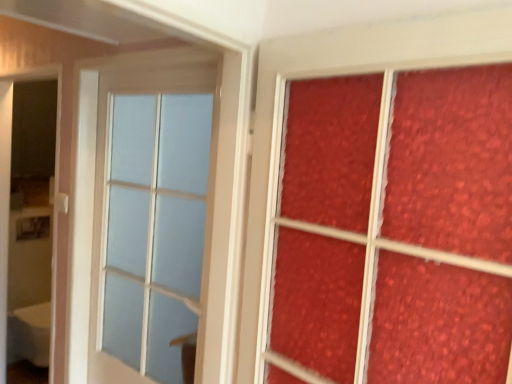
Measure the distance between matte glass window at center and camera.

The distance of matte glass window at center from camera is 4.80 feet.

I want to click on matte glass window at center, so click(154, 228).

The image size is (512, 384). What do you see at coordinates (62, 202) in the screenshot?
I see `white plastic door handle at upper left` at bounding box center [62, 202].

This screenshot has height=384, width=512. What do you see at coordinates (395, 230) in the screenshot?
I see `matte textured glass at right` at bounding box center [395, 230].

This screenshot has height=384, width=512. Find the location of `matte glass window at center`. matte glass window at center is located at coordinates (154, 228).

Considering the positions of objects matte glass window at center and white glossy screen door at left in the image provided, who is behind, matte glass window at center or white glossy screen door at left?

white glossy screen door at left is further away from the camera.

From a real-world perspective, is matte glass window at center located higher than white glossy screen door at left?

Yes, from a real-world perspective, matte glass window at center is over white glossy screen door at left

Looking at this image, is matte glass window at center not near white glossy screen door at left?

Actually, matte glass window at center and white glossy screen door at left are a little close together.

Considering the relative sizes of matte glass window at center and white glossy screen door at left in the image provided, is matte glass window at center thinner than white glossy screen door at left?

Yes, matte glass window at center is thinner than white glossy screen door at left.

Considering the sizes of matte textured glass at right and white glossy screen door at left in the image, is matte textured glass at right bigger or smaller than white glossy screen door at left?

Clearly, matte textured glass at right is smaller in size than white glossy screen door at left.

Is matte textured glass at right turned away from white glossy screen door at left?

No, matte textured glass at right is not facing away from white glossy screen door at left.

Are matte textured glass at right and white glossy screen door at left far apart?

Yes, matte textured glass at right and white glossy screen door at left are quite far apart.

Is matte textured glass at right surrounding white glossy screen door at left?

No, white glossy screen door at left is not surrounded by matte textured glass at right.

Is white plastic door handle at upper left thinner than white glossy screen door at left?

Yes, white plastic door handle at upper left is thinner than white glossy screen door at left.

Consider the image. Is white plastic door handle at upper left inside or outside of white glossy screen door at left?

white plastic door handle at upper left lies within the bounds of white glossy screen door at left.

Considering the positions of points (57, 203) and (0, 333), is point (57, 203) closer to camera compared to point (0, 333)?

That is True.

Is white plastic door handle at upper left touching white glossy screen door at left?

No, white plastic door handle at upper left is not making contact with white glossy screen door at left.

Based on the photo, which is more to the right, white glossy screen door at left or matte glass window at center?

From the viewer's perspective, matte glass window at center appears more on the right side.

Does point (5, 182) come farther from viewer compared to point (116, 129)?

Yes.

Is white glossy screen door at left outside of matte glass window at center?

white glossy screen door at left is positioned outside matte glass window at center.

From a real-world perspective, who is located lower, matte textured glass at right or matte glass window at center?

matte glass window at center is physically lower.

Is matte textured glass at right in front of or behind matte glass window at center in the image?

In the image, matte textured glass at right appears in front of matte glass window at center.

Looking at this image, is matte textured glass at right to the right of matte glass window at center from the viewer's perspective?

Yes, matte textured glass at right is to the right of matte glass window at center.

Which is in front, point (275, 313) or point (113, 296)?

The point (275, 313) is more forward.

From the image's perspective, is matte textured glass at right above white plastic door handle at upper left?

Incorrect, from the image's perspective, matte textured glass at right is lower than white plastic door handle at upper left.

Which point is more forward, [473,304] or [60,212]?

The point [473,304] is more forward.

Is matte textured glass at right in contact with white plastic door handle at upper left?

No, matte textured glass at right is not next to white plastic door handle at upper left.

Based on the photo, is matte textured glass at right not within white plastic door handle at upper left?

That's correct, matte textured glass at right is outside of white plastic door handle at upper left.

Are matte glass window at center and matte textured glass at right making contact?

No, matte glass window at center is not in contact with matte textured glass at right.

Is matte glass window at center looking in the opposite direction of matte textured glass at right?

No, matte glass window at center is not facing away from matte textured glass at right.

Does matte glass window at center have a greater height compared to matte textured glass at right?

Correct, matte glass window at center is much taller as matte textured glass at right.

Who is smaller, matte glass window at center or matte textured glass at right?

matte textured glass at right.

Image resolution: width=512 pixels, height=384 pixels. Find the location of `glass window above the white glossy screen door at left (from a real-world perspective)`. glass window above the white glossy screen door at left (from a real-world perspective) is located at coordinates (154, 228).

In the image, there is a matte textured glass at right. Where is `screen door below it (from a real-world perspective)`? The height and width of the screenshot is (384, 512). screen door below it (from a real-world perspective) is located at coordinates (11, 174).

Considering their positions, is matte glass window at center positioned further to matte textured glass at right than white plastic door handle at upper left?

Among the two, white plastic door handle at upper left is located further to matte textured glass at right.

Considering their positions, is white plastic door handle at upper left positioned closer to matte glass window at center than matte textured glass at right?

Among the two, white plastic door handle at upper left is located nearer to matte glass window at center.

Based on their spatial positions, is white plastic door handle at upper left or matte glass window at center closer to matte textured glass at right?

matte glass window at center is positioned closer to the anchor matte textured glass at right.

Which object lies nearer to the anchor point matte glass window at center, white plastic door handle at upper left or white glossy screen door at left?

Based on the image, white glossy screen door at left appears to be nearer to matte glass window at center.

Considering their positions, is matte textured glass at right positioned further to matte glass window at center than white glossy screen door at left?

matte textured glass at right is positioned further to the anchor matte glass window at center.

Which object lies nearer to the anchor point white plastic door handle at upper left, white glossy screen door at left or matte textured glass at right?

white glossy screen door at left is closer to white plastic door handle at upper left.

Which object lies further to the anchor point white plastic door handle at upper left, matte textured glass at right or matte glass window at center?

matte textured glass at right is positioned further to the anchor white plastic door handle at upper left.

When comparing their distances from white glossy screen door at left, does white plastic door handle at upper left or matte textured glass at right seem further?

matte textured glass at right is positioned further to the anchor white glossy screen door at left.

This screenshot has width=512, height=384. What are the coordinates of `door handle situated between white glossy screen door at left and matte glass window at center from left to right` in the screenshot? It's located at (62, 202).

The image size is (512, 384). In order to click on glass window between matte textured glass at right and white plastic door handle at upper left along the z-axis in this screenshot , I will do `click(154, 228)`.

This screenshot has height=384, width=512. In order to click on glass window between white glossy screen door at left and matte textured glass at right from left to right in this screenshot , I will do `click(154, 228)`.

Find the location of `door handle between white glossy screen door at left and matte textured glass at right from left to right`. door handle between white glossy screen door at left and matte textured glass at right from left to right is located at coordinates (62, 202).